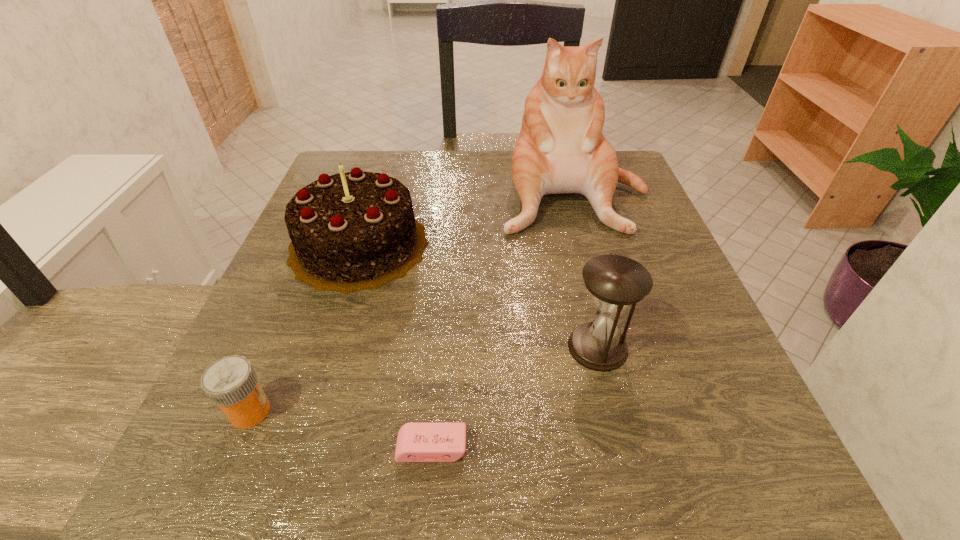
You are a GUI agent. You are given a task and a screenshot of the screen. Output one action in this format:
    pyautogui.click(x=<x>, y=<y>)
    Task: Click on the vacant space at the far edge of the desktop
    The height and width of the screenshot is (540, 960).
    Given the screenshot: What is the action you would take?
    pyautogui.click(x=481, y=176)

This screenshot has width=960, height=540. In the image, there is a desktop. What are the coordinates of `vacant area at the left edge` in the screenshot? It's located at (227, 433).

You are a GUI agent. You are given a task and a screenshot of the screen. Output one action in this format:
    pyautogui.click(x=<x>, y=<y>)
    Task: Click on the vacant region at the right edge
    The width and height of the screenshot is (960, 540).
    Given the screenshot: What is the action you would take?
    pyautogui.click(x=663, y=230)

I want to click on blank space at the near left corner, so click(295, 507).

Identify the location of vacant space at the far right corner of the desktop. Image resolution: width=960 pixels, height=540 pixels. (636, 197).

Locate an element on the screen. This screenshot has height=540, width=960. free space at the near right corner of the desktop is located at coordinates (664, 462).

This screenshot has height=540, width=960. In order to click on vacant area between the tallest object and the medicine in this screenshot , I will do `click(412, 302)`.

Image resolution: width=960 pixels, height=540 pixels. I want to click on free spot between the nearest object and the birthday cake, so click(396, 346).

You are a GUI agent. You are given a task and a screenshot of the screen. Output one action in this format:
    pyautogui.click(x=<x>, y=<y>)
    Task: Click on the unoccupied area between the third tallest object and the shortest object
    This screenshot has width=960, height=540.
    Given the screenshot: What is the action you would take?
    pyautogui.click(x=515, y=397)

At what (x,y) coordinates should I click in order to perform the action: click on unoccupied position between the cat and the second nearest object. Please return your answer as a coordinate pair (x, y). Looking at the image, I should click on (412, 302).